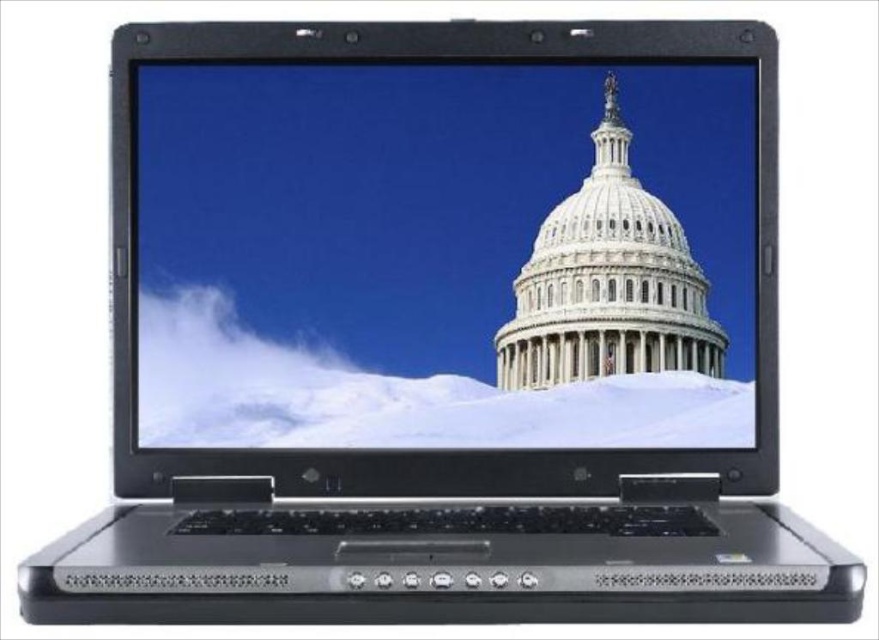
Between point (736, 202) and point (622, 236), which one is positioned in front?

Point (736, 202)

You are a GUI agent. You are given a task and a screenshot of the screen. Output one action in this format:
    pyautogui.click(x=<x>, y=<y>)
    Task: Click on the white glossy dome at center
    Image resolution: width=879 pixels, height=640 pixels.
    Given the screenshot: What is the action you would take?
    pyautogui.click(x=445, y=257)

Is point (593, 180) in front of point (645, 205)?

No, (593, 180) is further to viewer.

Locate an element on the screen. Image resolution: width=879 pixels, height=640 pixels. white glossy dome at center is located at coordinates (445, 257).